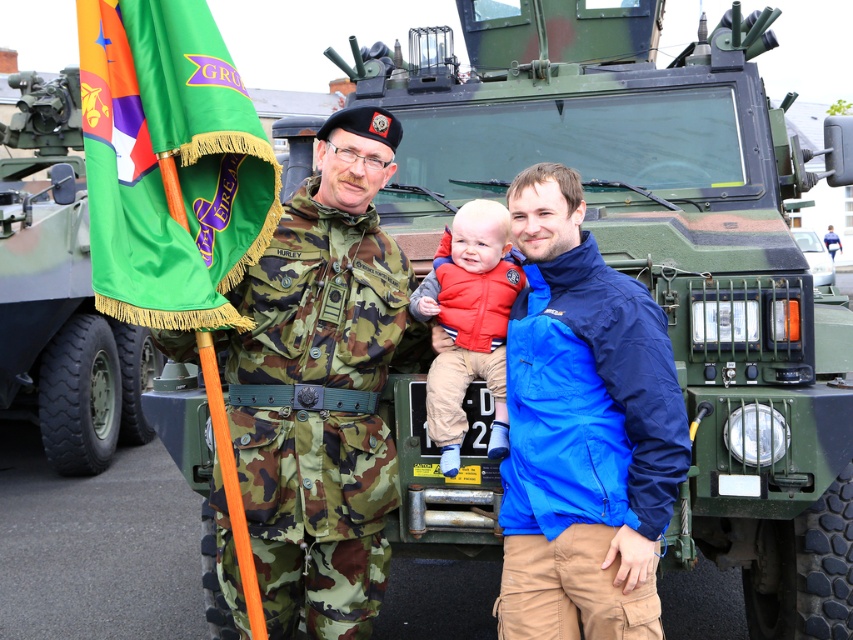
You are a photographer positioned behind the military vehicle. You need to capture a photo where both the green fabric flag at left and the camouflage fabric uniform at center are visible in the frame. Given their distance apart, will you be able to fit both into the camera frame without moving the camera?

The green fabric flag at left and camouflage fabric uniform at center are 86.59 feet apart. Since the distance between them is quite large, it is likely that the photographer will need to adjust the camera angle or use a wider lens to ensure both are visible in the frame without moving the camera.

You are a photographer taking a picture of the military vehicle and the three individuals. The green fabric flag at left is currently positioned at point 0.252 on the horizontal axis and 0.200 on the vertical axis. To ensure the flag is centered in the frame, where should you adjust the camera? Specify the new coordinates for the flag.

The green fabric flag at left is currently at coordinates 0.252 horizontally and 0.200 vertically. To center it, move the flag to 0.5 on both axes.